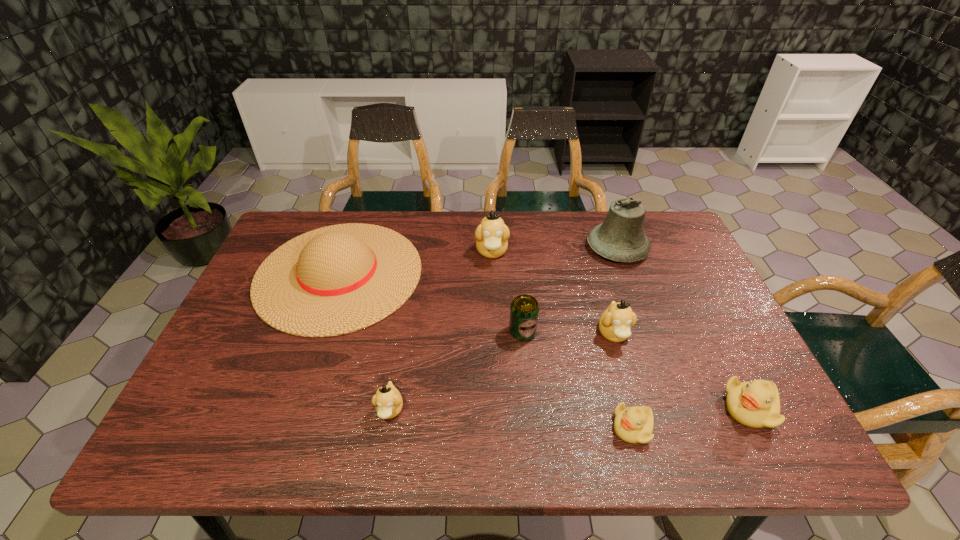
In order to click on the fourth closest duckling to the shortest object in this screenshot , I will do `click(492, 234)`.

Locate which tan duckling is the second closest to the farthest tan duckling. Please provide its 2D coordinates. Your answer should be formatted as a tuple, i.e. [(x, y)], where the tuple contains the x and y coordinates of a point satisfying the conditions above.

[(388, 402)]

Select which tan duckling appears as the closest to the green beer can. Please provide its 2D coordinates. Your answer should be formatted as a tuple, i.e. [(x, y)], where the tuple contains the x and y coordinates of a point satisfying the conditions above.

[(615, 323)]